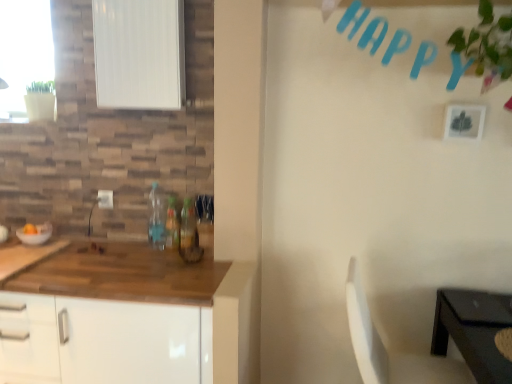
Question: Can translucent plastic bottle at center, which is the 3th bottle from right to left, be found inside green leafy plant at upper right?

Choices:
 (A) yes
 (B) no

Answer: (B)

Question: Considering the relative sizes of green leafy plant at upper right and translucent plastic bottle at center, the first bottle viewed from the left, in the image provided, is green leafy plant at upper right taller than translucent plastic bottle at center, the first bottle viewed from the left,?

Choices:
 (A) yes
 (B) no

Answer: (A)

Question: Are green leafy plant at upper right and translucent plastic bottle at center, the first bottle viewed from the left, far apart?

Choices:
 (A) yes
 (B) no

Answer: (A)

Question: Is green leafy plant at upper right facing away from translucent plastic bottle at center, the first bottle viewed from the left?

Choices:
 (A) yes
 (B) no

Answer: (B)

Question: Could you tell me if green leafy plant at upper right is facing translucent plastic bottle at center, the first bottle viewed from the left?

Choices:
 (A) no
 (B) yes

Answer: (A)

Question: Can you confirm if green leafy plant at upper right is smaller than translucent plastic bottle at center, which is the 3th bottle from right to left?

Choices:
 (A) no
 (B) yes

Answer: (A)

Question: Is translucent glass bottle at center, the third bottle positioned from the left, oriented away from white matte window screen at upper left?

Choices:
 (A) no
 (B) yes

Answer: (A)

Question: Is translucent glass bottle at center, positioned as the 1th bottle in right-to-left order, shorter than white matte window screen at upper left?

Choices:
 (A) yes
 (B) no

Answer: (A)

Question: Does translucent glass bottle at center, the third bottle positioned from the left, have a greater width compared to white matte window screen at upper left?

Choices:
 (A) no
 (B) yes

Answer: (A)

Question: Would you say translucent glass bottle at center, the third bottle positioned from the left, contains white matte window screen at upper left?

Choices:
 (A) no
 (B) yes

Answer: (A)

Question: Is translucent glass bottle at center, the third bottle positioned from the left, aimed at white matte window screen at upper left?

Choices:
 (A) no
 (B) yes

Answer: (A)

Question: Can you confirm if translucent glass bottle at center, positioned as the 1th bottle in right-to-left order, is positioned to the left of white matte window screen at upper left?

Choices:
 (A) no
 (B) yes

Answer: (A)

Question: Is white matte picture frame at upper right positioned in front of translucent plastic bottle at center, which is the 3th bottle from right to left?

Choices:
 (A) no
 (B) yes

Answer: (B)